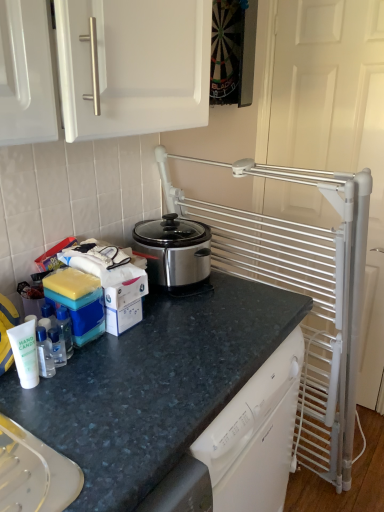
Image resolution: width=384 pixels, height=512 pixels. Find the location of `free location to the right of clear plastic bottle at left, which is counted as the second bottle, starting from the back`. free location to the right of clear plastic bottle at left, which is counted as the second bottle, starting from the back is located at coordinates (102, 394).